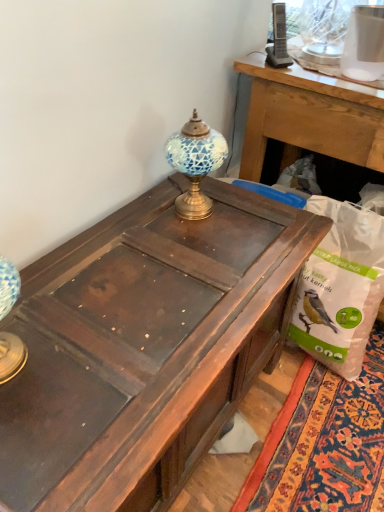
Question: Considering the relative positions of white plastic bag at lower right and dark brown wood desk at center in the image provided, is white plastic bag at lower right to the right of dark brown wood desk at center from the viewer's perspective?

Choices:
 (A) no
 (B) yes

Answer: (B)

Question: Can you confirm if white plastic bag at lower right is thinner than dark brown wood desk at center?

Choices:
 (A) yes
 (B) no

Answer: (A)

Question: Does white plastic bag at lower right have a lesser height compared to dark brown wood desk at center?

Choices:
 (A) no
 (B) yes

Answer: (B)

Question: Does white plastic bag at lower right have a greater width compared to dark brown wood desk at center?

Choices:
 (A) no
 (B) yes

Answer: (A)

Question: Does white plastic bag at lower right come in front of dark brown wood desk at center?

Choices:
 (A) yes
 (B) no

Answer: (B)

Question: Are white plastic bag at lower right and dark brown wood desk at center beside each other?

Choices:
 (A) no
 (B) yes

Answer: (A)

Question: Is white plastic bag at lower right at the back of dark brown wood desk at center?

Choices:
 (A) no
 (B) yes

Answer: (A)

Question: Is dark brown wood desk at center smaller than white plastic bag at lower right?

Choices:
 (A) no
 (B) yes

Answer: (A)

Question: From a real-world perspective, is dark brown wood desk at center located beneath white plastic bag at lower right?

Choices:
 (A) no
 (B) yes

Answer: (A)

Question: Is dark brown wood desk at center further to camera compared to white plastic bag at lower right?

Choices:
 (A) yes
 (B) no

Answer: (B)

Question: From the image's perspective, is dark brown wood desk at center beneath white plastic bag at lower right?

Choices:
 (A) yes
 (B) no

Answer: (A)

Question: Is dark brown wood desk at center wider than white plastic bag at lower right?

Choices:
 (A) no
 (B) yes

Answer: (B)

Question: Would you say white plastic bag at lower right is outside blue mosaic glass at center?

Choices:
 (A) no
 (B) yes

Answer: (B)